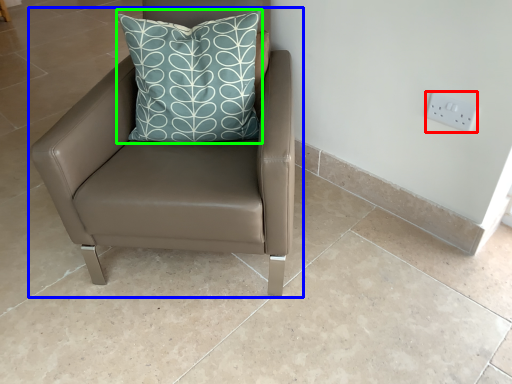
Question: Which object is the farthest from electric outlet (highlighted by a red box)? Choose among these: chair (highlighted by a blue box) or pillow (highlighted by a green box).

Choices:
 (A) chair
 (B) pillow

Answer: (A)